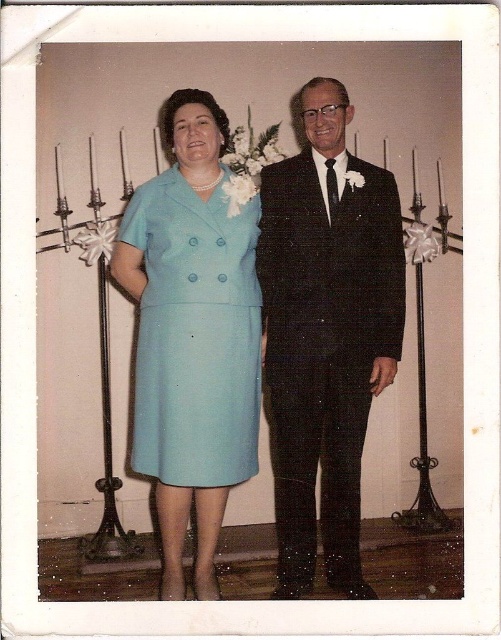
You are a photographer adjusting the camera settings to ensure both the black textured suit at center and the light blue fabric dress at center are in focus. Since the camera can only focus on one subject at a time, which subject should you choose to ensure the wider one is sharp?

The black textured suit at center is wider than the light blue fabric dress at center, so you should focus on the black textured suit at center to ensure the wider subject is sharp.